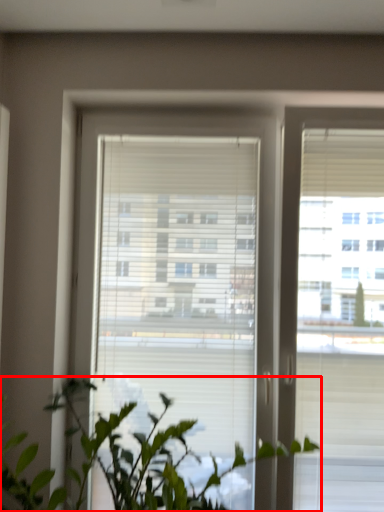
Question: From the image's perspective, where is houseplant (annotated by the red box) located in relation to window in the image?

Choices:
 (A) above
 (B) below

Answer: (B)